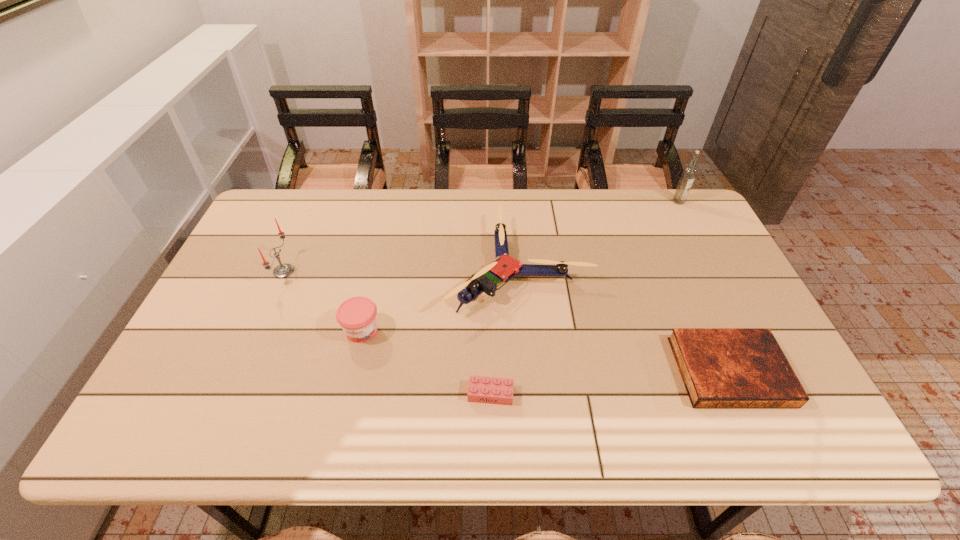
Where is `object that is at the near right corner`? object that is at the near right corner is located at coordinates (720, 367).

At what (x,y) coordinates should I click in order to perform the action: click on vacant space at the far edge of the desktop. Please return your answer as a coordinate pair (x, y). This screenshot has height=540, width=960. Looking at the image, I should click on (447, 214).

The height and width of the screenshot is (540, 960). I want to click on vacant space at the near edge of the desktop, so click(x=562, y=418).

The height and width of the screenshot is (540, 960). In order to click on vacant region at the left edge of the desktop in this screenshot , I will do `click(225, 384)`.

In the image, there is a desktop. At what (x,y) coordinates should I click in order to perform the action: click on vacant area at the right edge. Please return your answer as a coordinate pair (x, y). The height and width of the screenshot is (540, 960). Looking at the image, I should click on (718, 259).

In the image, there is a desktop. Identify the location of vacant space at the far left corner. (282, 223).

Find the location of a particular element. vacant space at the far right corner of the desktop is located at coordinates (700, 222).

You are a GUI agent. You are given a task and a screenshot of the screen. Output one action in this format:
    pyautogui.click(x=<x>, y=<y>)
    Task: Click on the vacant space in between the drone and the Lego
    This screenshot has width=960, height=540.
    Given the screenshot: What is the action you would take?
    pyautogui.click(x=505, y=330)

Identify the location of free space that is in between the Bible and the Lego. (611, 382).

Identify the location of free space between the drone and the Bible. (624, 319).